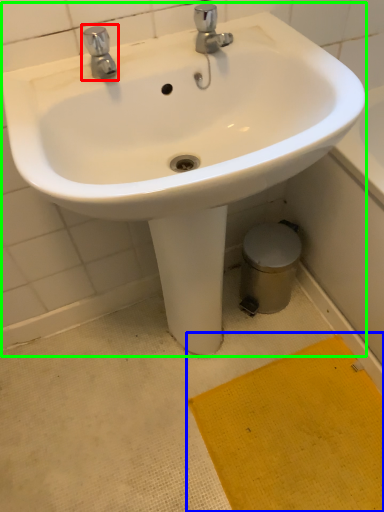
Question: Which object is the farthest from tap (highlighted by a red box)? Choose among these: doormat (highlighted by a blue box) or sink (highlighted by a green box).

Choices:
 (A) doormat
 (B) sink

Answer: (A)